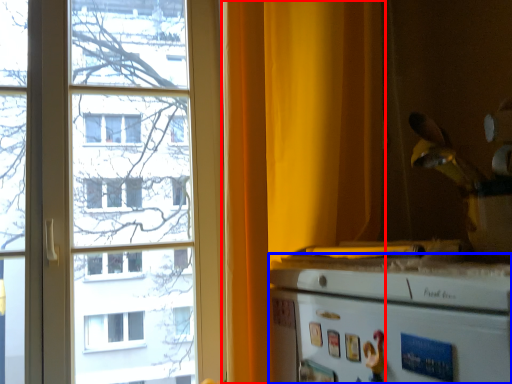
Question: Which object is closer to the camera taking this photo, curtain (highlighted by a red box) or appliance (highlighted by a blue box)?

Choices:
 (A) curtain
 (B) appliance

Answer: (B)